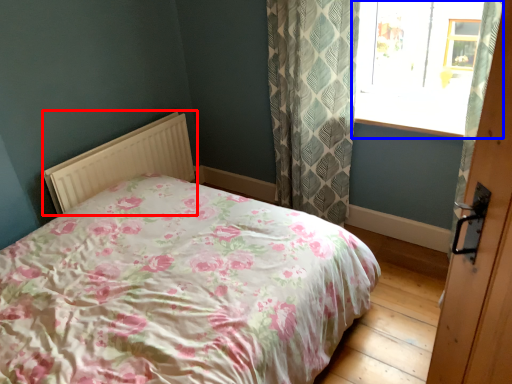
Question: Which point is closer to the camera, radiator (highlighted by a red box) or window (highlighted by a blue box)?

Choices:
 (A) radiator
 (B) window

Answer: (B)